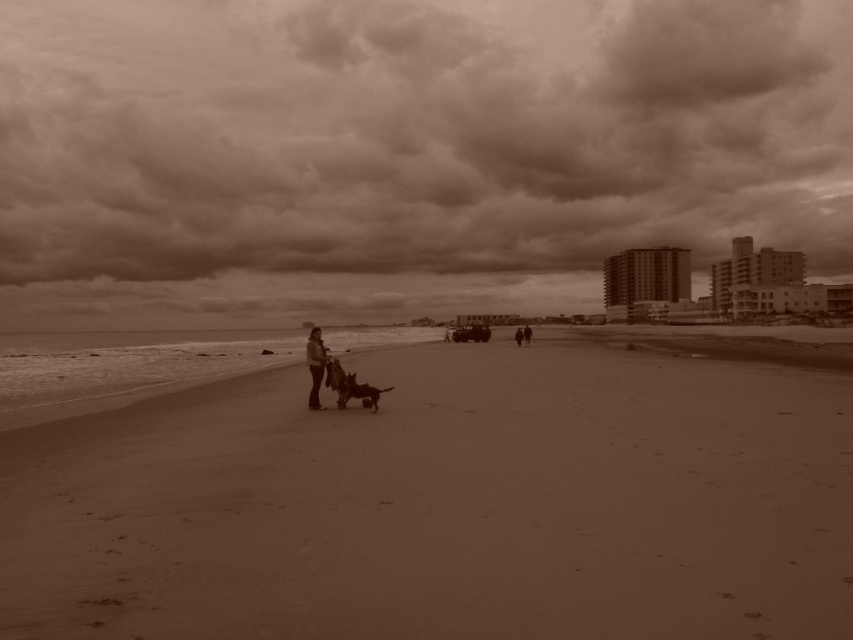
Which is more to the right, smooth sand at center or dark brown leather jacket at center?

dark brown leather jacket at center

Does point (511, 554) come closer to viewer compared to point (515, 330)?

Yes, point (511, 554) is closer to viewer.

Identify the location of smooth sand at center. (444, 504).

Does point (312, 397) come in front of point (521, 336)?

Yes, point (312, 397) is closer to viewer.

Who is positioned more to the right, matte black jacket at center or dark brown leather jacket at center?

Positioned to the right is dark brown leather jacket at center.

Who is more forward, (x=312, y=340) or (x=521, y=330)?

Positioned in front is point (x=312, y=340).

Locate an element on the screen. Image resolution: width=853 pixels, height=640 pixels. matte black jacket at center is located at coordinates (315, 364).

Is smooth sand at center behind matte black jacket at center?

No, it is not.

Does smooth sand at center have a lesser height compared to matte black jacket at center?

Correct, smooth sand at center is not as tall as matte black jacket at center.

The image size is (853, 640). Find the location of `smooth sand at center`. smooth sand at center is located at coordinates (444, 504).

Where is `smooth sand at center`? This screenshot has height=640, width=853. smooth sand at center is located at coordinates (444, 504).